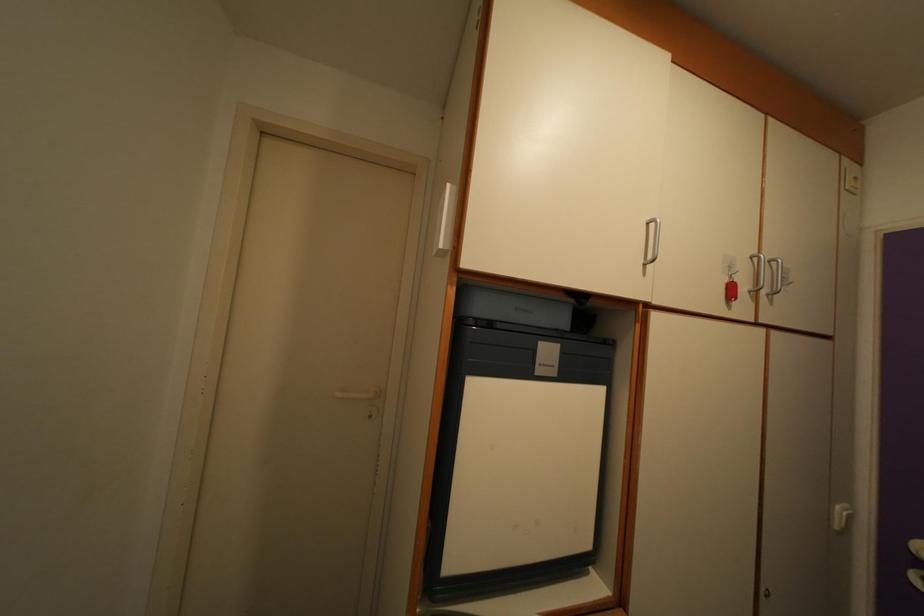
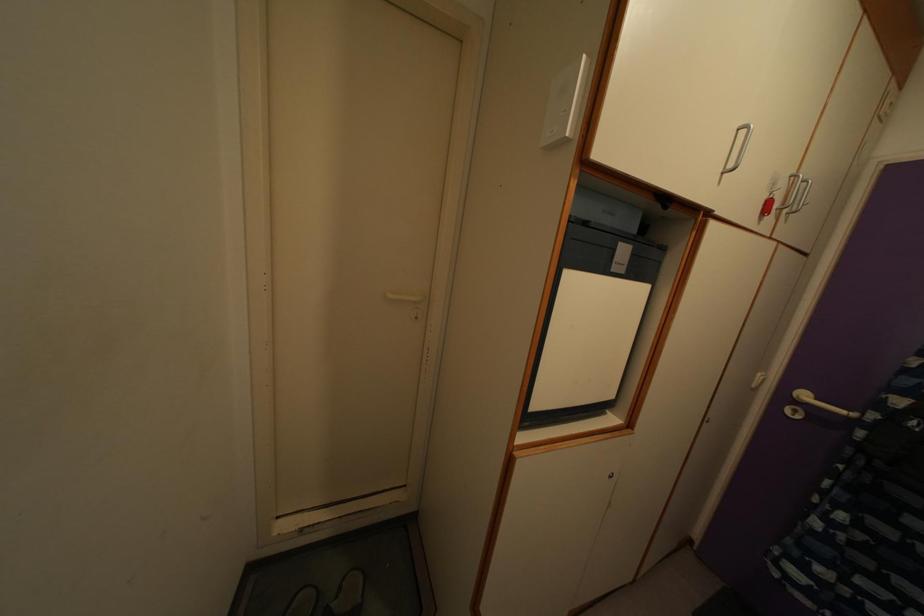
Question: The images are taken continuously from a first-person perspective. In which direction are you moving?

Choices:
 (A) Left
 (B) Right
 (C) Forward
 (D) Backward

Answer: (A)